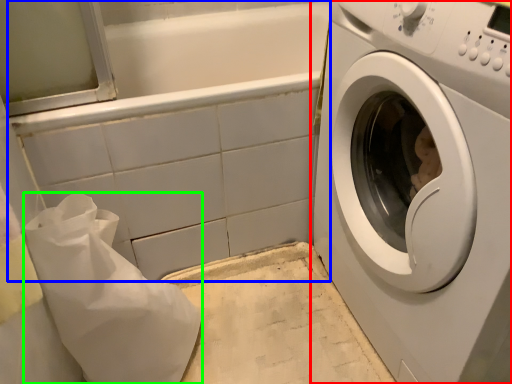
Question: Estimate the real-world distances between objects in this image. Which object is closer to washing machine (highlighted by a red box), bath (highlighted by a blue box) or material (highlighted by a green box)?

Choices:
 (A) bath
 (B) material

Answer: (A)